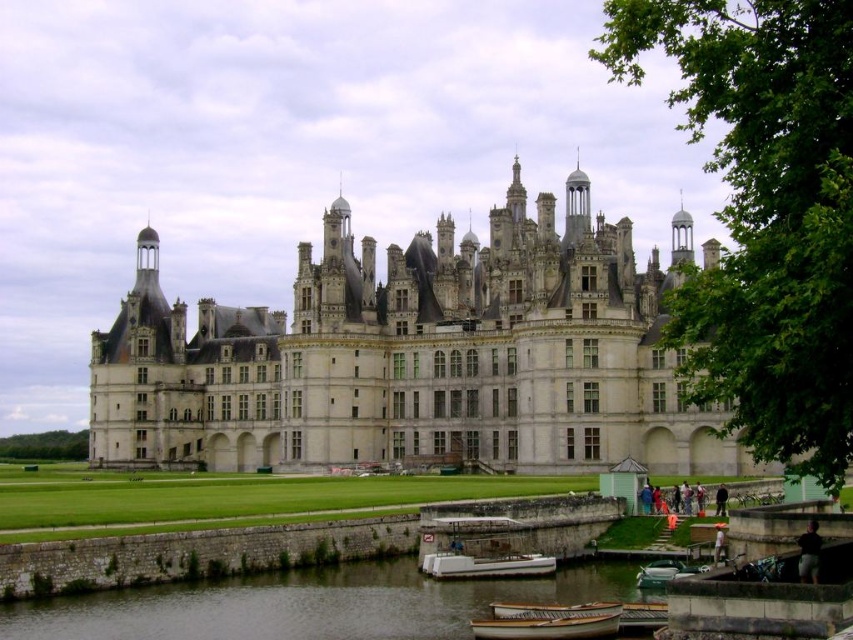
You are an architect visiting the castle and want to compare the sizes of the white stone castle at center and the white plastic boat at lower center. Based on the scene, which one is wider?

The white stone castle at center is wider than the white plastic boat at lower center.

You are standing on the stone wall in front of the castle. You see the green stone river at lower center. Where is the green stone river located in relation to your position?

The green stone river at lower center is located at the point with coordinates 0.945 on the x axis and 0.365 on the y axis relative to your position on the stone wall.